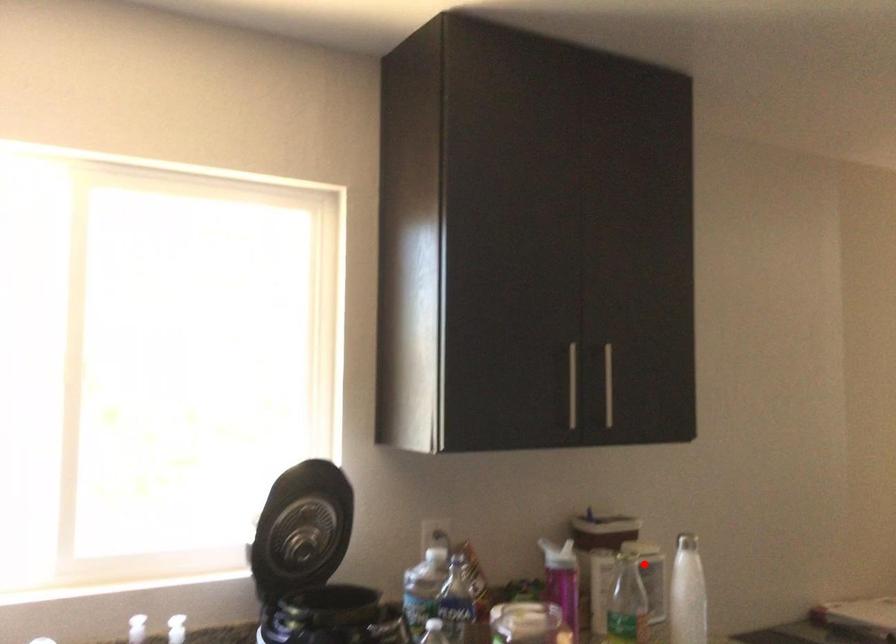
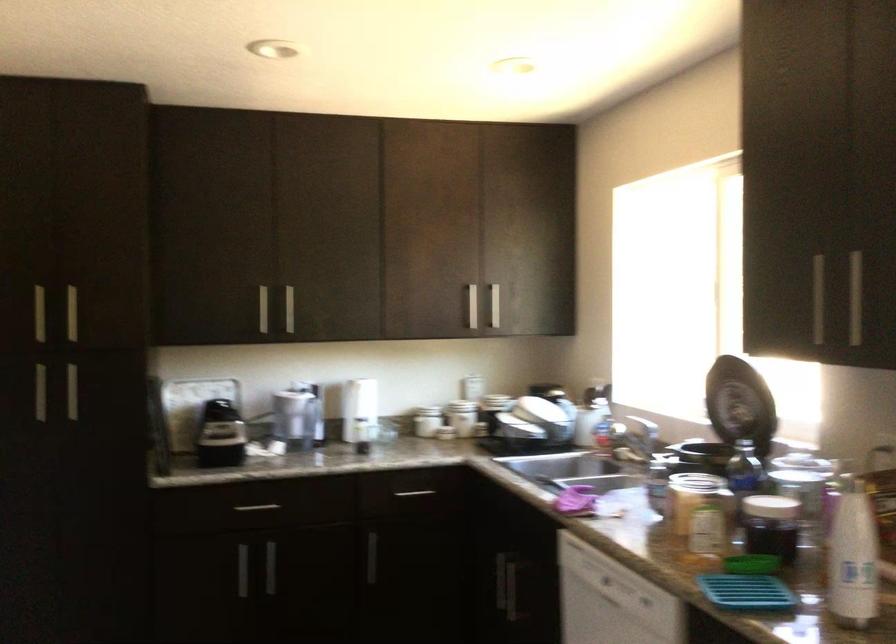
Locate, in the second image, the point that corresponds to the highlighted location in the first image.

(853, 556)